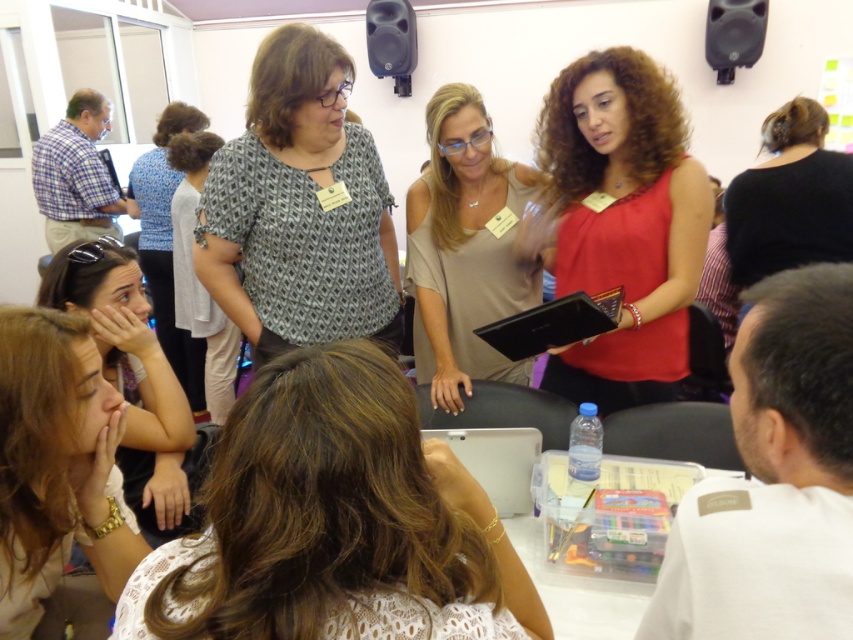
Is point (776, 227) in front of point (172, 134)?

Yes, it is.

Consider the image. Does black matte hair at upper right appear under light blue fabric shirt at upper left?

No.

Who is more forward, (822, 259) or (202, 387)?

Point (822, 259) is more forward.

Locate an element on the screen. The width and height of the screenshot is (853, 640). black matte hair at upper right is located at coordinates (788, 198).

Is matte red tank top at center bigger than beige fabric blouse at center?

No, matte red tank top at center is not bigger than beige fabric blouse at center.

Is point (560, 371) closer to camera compared to point (535, 296)?

Yes, it is in front of point (535, 296).

Identify the location of matte red tank top at center. Image resolution: width=853 pixels, height=640 pixels. (624, 224).

How much distance is there between white lace shirt at center and black matte hair at upper right?

A distance of 2.18 meters exists between white lace shirt at center and black matte hair at upper right.

Can you confirm if white lace shirt at center is wider than black matte hair at upper right?

Yes, white lace shirt at center is wider than black matte hair at upper right.

Identify the location of white lace shirt at center. The image size is (853, 640). (332, 518).